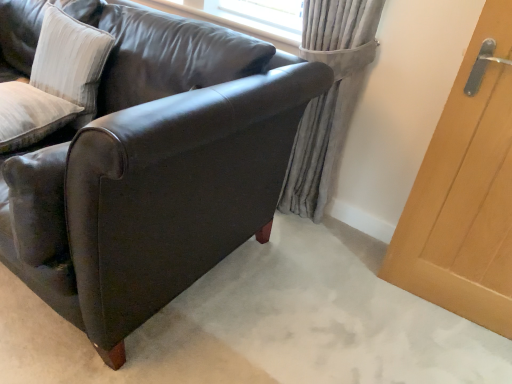
This screenshot has width=512, height=384. What do you see at coordinates (328, 98) in the screenshot?
I see `gray fabric curtain at upper right` at bounding box center [328, 98].

In order to face matte black leather couch at center, should I rotate leftwards or rightwards?

You should rotate left by 23.817 degrees.

Identify the location of gray fabric curtain at upper right. Image resolution: width=512 pixels, height=384 pixels. (328, 98).

Considering the sizes of objects matte black leather couch at center and white textured cushion at upper left, the 1th pillow from the top, in the image provided, who is thinner, matte black leather couch at center or white textured cushion at upper left, the 1th pillow from the top,?

white textured cushion at upper left, the 1th pillow from the top, is thinner.

Considering the positions of objects matte black leather couch at center and white textured cushion at upper left, the 2th pillow in the bottom-to-top sequence, in the image provided, who is more to the right, matte black leather couch at center or white textured cushion at upper left, the 2th pillow in the bottom-to-top sequence,?

white textured cushion at upper left, the 2th pillow in the bottom-to-top sequence, is more to the right.

Based on the photo, is matte black leather couch at center in front of or behind white textured cushion at upper left, the 2th pillow in the bottom-to-top sequence, in the image?

In the image, matte black leather couch at center appears in front of white textured cushion at upper left, the 2th pillow in the bottom-to-top sequence.

From the image's perspective, would you say matte black leather couch at center is positioned over white textured cushion at upper left, the 1th pillow from the top?

No.

Which is farther from the camera, (17,245) or (3,85)?

Positioned behind is point (3,85).

From the image's perspective, is matte black leather couch at center over white textured pillow at upper left, which ranks as the 1th pillow in bottom-to-top order?

Correct, matte black leather couch at center appears higher than white textured pillow at upper left, which ranks as the 1th pillow in bottom-to-top order, in the image.

Is matte black leather couch at center to the left of white textured pillow at upper left, which ranks as the 1th pillow in bottom-to-top order, from the viewer's perspective?

No, matte black leather couch at center is not to the left of white textured pillow at upper left, which ranks as the 1th pillow in bottom-to-top order.

Does matte black leather couch at center have a lesser height compared to white textured pillow at upper left, which ranks as the 1th pillow in bottom-to-top order?

No.

Is gray fabric curtain at upper right wider than matte black leather couch at center?

In fact, gray fabric curtain at upper right might be narrower than matte black leather couch at center.

How many degrees apart are the facing directions of gray fabric curtain at upper right and matte black leather couch at center?

gray fabric curtain at upper right and matte black leather couch at center are facing 2.29e-05 degrees away from each other.

Is gray fabric curtain at upper right placed right next to matte black leather couch at center?

gray fabric curtain at upper right is not next to matte black leather couch at center, and they're not touching.

Consider the image. From the image's perspective, is gray fabric curtain at upper right beneath matte black leather couch at center?

No, from the image's perspective, gray fabric curtain at upper right is not beneath matte black leather couch at center.

From the image's perspective, which one is positioned higher, white textured pillow at upper left, which ranks as the 1th pillow in bottom-to-top order, or light brown wood door at right?

From the image's view, white textured pillow at upper left, which ranks as the 1th pillow in bottom-to-top order, is above.

Which object is positioned more to the right, white textured pillow at upper left, which ranks as the 1th pillow in bottom-to-top order, or light brown wood door at right?

From the viewer's perspective, light brown wood door at right appears more on the right side.

Does white textured pillow at upper left, which ranks as the 1th pillow in bottom-to-top order, turn towards light brown wood door at right?

No, white textured pillow at upper left, which ranks as the 1th pillow in bottom-to-top order, is not facing towards light brown wood door at right.

Between white textured cushion at upper left, the 1th pillow from the top, and white textured pillow at upper left, the 2th pillow viewed from the top, which one appears on the left side from the viewer's perspective?

white textured pillow at upper left, the 2th pillow viewed from the top.

From a real-world perspective, between white textured cushion at upper left, the 1th pillow from the top, and white textured pillow at upper left, which ranks as the 1th pillow in bottom-to-top order, who is vertically higher?

white textured cushion at upper left, the 1th pillow from the top.

Is the position of white textured cushion at upper left, the 2th pillow in the bottom-to-top sequence, less distant than that of white textured pillow at upper left, which ranks as the 1th pillow in bottom-to-top order?

No, white textured cushion at upper left, the 2th pillow in the bottom-to-top sequence, is further to the viewer.

Can we say white textured cushion at upper left, the 2th pillow in the bottom-to-top sequence, lies outside white textured pillow at upper left, which ranks as the 1th pillow in bottom-to-top order?

white textured cushion at upper left, the 2th pillow in the bottom-to-top sequence, lies outside white textured pillow at upper left, which ranks as the 1th pillow in bottom-to-top order,'s area.

Is white textured pillow at upper left, the 2th pillow viewed from the top, situated inside matte black leather couch at center or outside?

white textured pillow at upper left, the 2th pillow viewed from the top, is inside matte black leather couch at center.

Considering the relative positions of white textured pillow at upper left, which ranks as the 1th pillow in bottom-to-top order, and matte black leather couch at center in the image provided, is white textured pillow at upper left, which ranks as the 1th pillow in bottom-to-top order, in front of matte black leather couch at center?

No, it is not.

From the picture: Between white textured pillow at upper left, the 2th pillow viewed from the top, and matte black leather couch at center, which one appears on the left side from the viewer's perspective?

From the viewer's perspective, white textured pillow at upper left, the 2th pillow viewed from the top, appears more on the left side.

From a real-world perspective, which is physically above, white textured pillow at upper left, which ranks as the 1th pillow in bottom-to-top order, or matte black leather couch at center?

white textured pillow at upper left, which ranks as the 1th pillow in bottom-to-top order, from a real-world perspective.

Is white textured cushion at upper left, the 1th pillow from the top, shorter than light brown wood door at right?

Indeed, white textured cushion at upper left, the 1th pillow from the top, has a lesser height compared to light brown wood door at right.

In terms of width, does white textured cushion at upper left, the 1th pillow from the top, look wider or thinner when compared to light brown wood door at right?

In the image, white textured cushion at upper left, the 1th pillow from the top, appears to be wider than light brown wood door at right.

From the image's perspective, is white textured cushion at upper left, the 1th pillow from the top, positioned above or below light brown wood door at right?

Clearly, from the image's perspective, white textured cushion at upper left, the 1th pillow from the top, is above light brown wood door at right.

Identify the location of studio couch located on the left of white textured cushion at upper left, the 1th pillow from the top. (154, 172).

The height and width of the screenshot is (384, 512). I want to click on pillow below the matte black leather couch at center (from the image's perspective), so click(30, 115).

Which object lies further to the anchor point white textured pillow at upper left, the 2th pillow viewed from the top, matte black leather couch at center or light brown wood door at right?

light brown wood door at right lies further to white textured pillow at upper left, the 2th pillow viewed from the top, than the other object.

When comparing their distances from light brown wood door at right, does white textured cushion at upper left, the 2th pillow in the bottom-to-top sequence, or white textured pillow at upper left, the 2th pillow viewed from the top, seem further?

Based on the image, white textured pillow at upper left, the 2th pillow viewed from the top, appears to be further to light brown wood door at right.

When comparing their distances from gray fabric curtain at upper right, does matte black leather couch at center or light brown wood door at right seem further?

Based on the image, matte black leather couch at center appears to be further to gray fabric curtain at upper right.

From the image, which object appears to be farther from light brown wood door at right, white textured cushion at upper left, the 1th pillow from the top, or gray fabric curtain at upper right?

white textured cushion at upper left, the 1th pillow from the top.

Consider the image. Considering their positions, is matte black leather couch at center positioned closer to white textured cushion at upper left, the 2th pillow in the bottom-to-top sequence, than light brown wood door at right?

Among the two, matte black leather couch at center is located nearer to white textured cushion at upper left, the 2th pillow in the bottom-to-top sequence.

Considering their positions, is light brown wood door at right positioned further to white textured pillow at upper left, the 2th pillow viewed from the top, than white textured cushion at upper left, the 1th pillow from the top?

light brown wood door at right lies further to white textured pillow at upper left, the 2th pillow viewed from the top, than the other object.

Which object lies nearer to the anchor point gray fabric curtain at upper right, white textured pillow at upper left, the 2th pillow viewed from the top, or matte black leather couch at center?

A: matte black leather couch at center is positioned closer to the anchor gray fabric curtain at upper right.

Based on their spatial positions, is light brown wood door at right or matte black leather couch at center further from white textured cushion at upper left, the 1th pillow from the top?

The object further to white textured cushion at upper left, the 1th pillow from the top, is light brown wood door at right.

This screenshot has width=512, height=384. I want to click on pillow situated between matte black leather couch at center and gray fabric curtain at upper right from left to right, so click(x=70, y=61).

Identify the location of pillow located between matte black leather couch at center and white textured cushion at upper left, the 1th pillow from the top, in the depth direction. The image size is (512, 384). (30, 115).

Where is `pillow between white textured pillow at upper left, which ranks as the 1th pillow in bottom-to-top order, and light brown wood door at right from left to right`? The image size is (512, 384). pillow between white textured pillow at upper left, which ranks as the 1th pillow in bottom-to-top order, and light brown wood door at right from left to right is located at coordinates (70, 61).

Where is `curtain between white textured pillow at upper left, which ranks as the 1th pillow in bottom-to-top order, and light brown wood door at right`? This screenshot has height=384, width=512. curtain between white textured pillow at upper left, which ranks as the 1th pillow in bottom-to-top order, and light brown wood door at right is located at coordinates (328, 98).